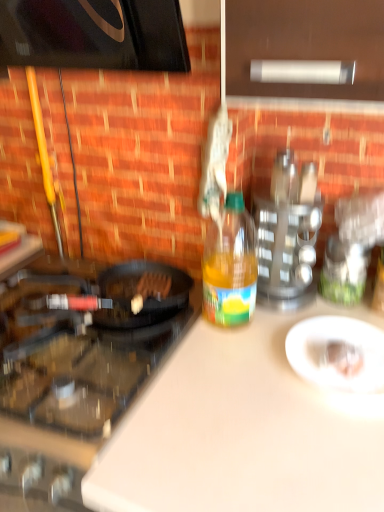
Question: Does white glossy plate at center have a lesser width compared to metallic silver spice rack at upper right?

Choices:
 (A) no
 (B) yes

Answer: (B)

Question: Is white glossy plate at center wider than metallic silver spice rack at upper right?

Choices:
 (A) no
 (B) yes

Answer: (A)

Question: Is metallic silver spice rack at upper right located within white glossy plate at center?

Choices:
 (A) yes
 (B) no

Answer: (B)

Question: Is white glossy plate at center positioned far away from metallic silver spice rack at upper right?

Choices:
 (A) yes
 (B) no

Answer: (B)

Question: Is white glossy plate at center to the right of metallic silver spice rack at upper right from the viewer's perspective?

Choices:
 (A) yes
 (B) no

Answer: (A)

Question: Which is correct: black glass gas stove at left is inside white matte cutting board at center, or outside of it?

Choices:
 (A) inside
 (B) outside

Answer: (B)

Question: Considering the positions of black glass gas stove at left and white matte cutting board at center in the image, is black glass gas stove at left bigger or smaller than white matte cutting board at center?

Choices:
 (A) small
 (B) big

Answer: (A)

Question: Relative to white matte cutting board at center, is black glass gas stove at left in front or behind?

Choices:
 (A) front
 (B) behind

Answer: (B)

Question: Is point (74, 261) positioned closer to the camera than point (294, 468)?

Choices:
 (A) farther
 (B) closer

Answer: (A)

Question: Considering the positions of white matte cutting board at center and black glass gas stove at left in the image, is white matte cutting board at center bigger or smaller than black glass gas stove at left?

Choices:
 (A) small
 (B) big

Answer: (B)

Question: Relative to black glass gas stove at left, is white matte cutting board at center in front or behind?

Choices:
 (A) front
 (B) behind

Answer: (A)

Question: Is white matte cutting board at center inside the boundaries of black glass gas stove at left, or outside?

Choices:
 (A) outside
 (B) inside

Answer: (A)

Question: Looking at their shapes, would you say white matte cutting board at center is wider or thinner than black glass gas stove at left?

Choices:
 (A) thin
 (B) wide

Answer: (B)

Question: Is point (210, 320) closer or farther from the camera than point (59, 322)?

Choices:
 (A) closer
 (B) farther

Answer: (A)

Question: From a real-world perspective, is yellow translucent bottle at center above or below black glass gas stove at left?

Choices:
 (A) below
 (B) above

Answer: (B)